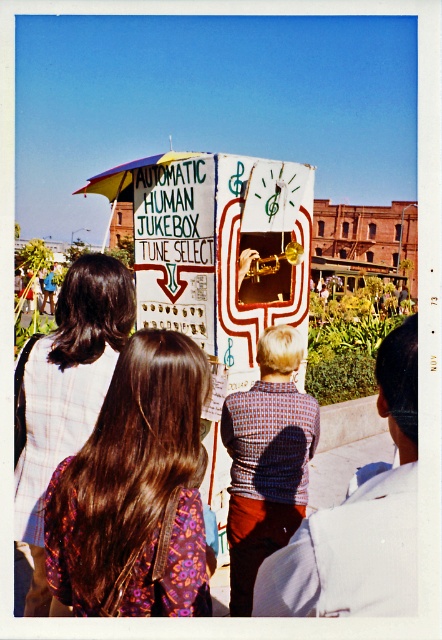
You are a photographer at the event and want to capture both the brown hair at center and the knitted sweater at center in a single shot. Which object should you focus on first to ensure both are in frame?

The brown hair at center is bigger than the knitted sweater at center, so you should focus on the brown hair at center first to ensure both are in frame.

You are a photographer at the event and want to capture both the plaid fabric shirt at upper left and the knitted sweater at center in a single photo. Which clothing item will appear larger in the photo?

The plaid fabric shirt at upper left will appear larger in the photo because it is bigger than the knitted sweater at center.

You are a photographer trying to capture a photo of the brown hair at center and the knitted sweater at center in the same frame. Given that your camera has a maximum focus range of 15 feet, will both subjects be in focus?

The brown hair at center and knitted sweater at center are 14.80 feet apart from each other. Since the distance between them is within the camera maximum focus range of 15 feet, both subjects will be in focus.